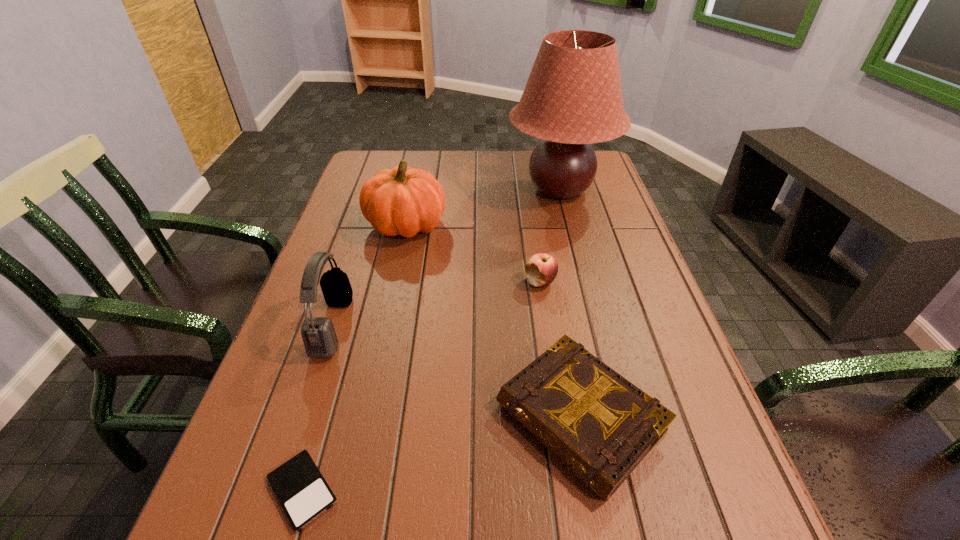
You are a GUI agent. You are given a task and a screenshot of the screen. Output one action in this format:
    pyautogui.click(x=<x>, y=<y>)
    Task: Click on the vacant space located on the front of the third shortest object
    
    Given the screenshot: What is the action you would take?
    pyautogui.click(x=564, y=447)

In order to click on vacant space located 0.350m on the back of the hardback book in this screenshot , I will do `click(548, 246)`.

Locate an element on the screen. vacant region located on the right of the iPod is located at coordinates (417, 490).

In order to click on object located in the far edge section of the desktop in this screenshot , I will do `click(573, 98)`.

Where is `pumpkin that is at the left edge`? The height and width of the screenshot is (540, 960). pumpkin that is at the left edge is located at coordinates (403, 201).

Identify the location of headset positioned at the left edge. (319, 337).

Image resolution: width=960 pixels, height=540 pixels. I want to click on iPod situated at the left edge, so click(301, 489).

Image resolution: width=960 pixels, height=540 pixels. I want to click on lampshade that is at the right edge, so click(573, 98).

This screenshot has width=960, height=540. I want to click on hardback book present at the right edge, so click(601, 426).

Locate an element on the screen. This screenshot has height=540, width=960. object located in the far right corner section of the desktop is located at coordinates (573, 98).